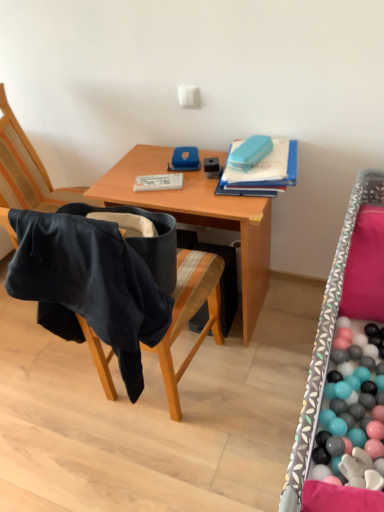
The height and width of the screenshot is (512, 384). Find the location of `empty space that is ontop of blue matte folder at upper right (from a real-world perspective)`. empty space that is ontop of blue matte folder at upper right (from a real-world perspective) is located at coordinates coord(270,154).